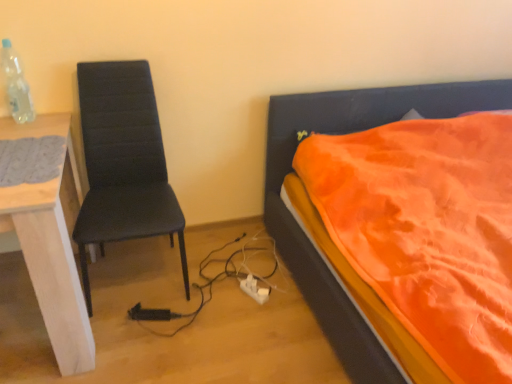
Find the location of a particular element. Image resolution: width=512 pixels, height=384 pixels. vacant area that is in front of white plastic power plugs and sockets at lower center is located at coordinates (255, 319).